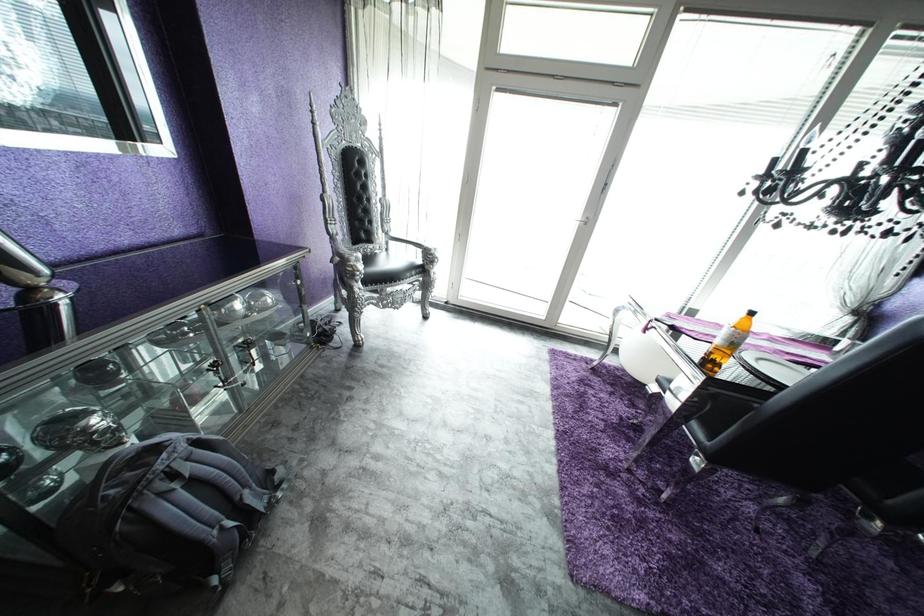
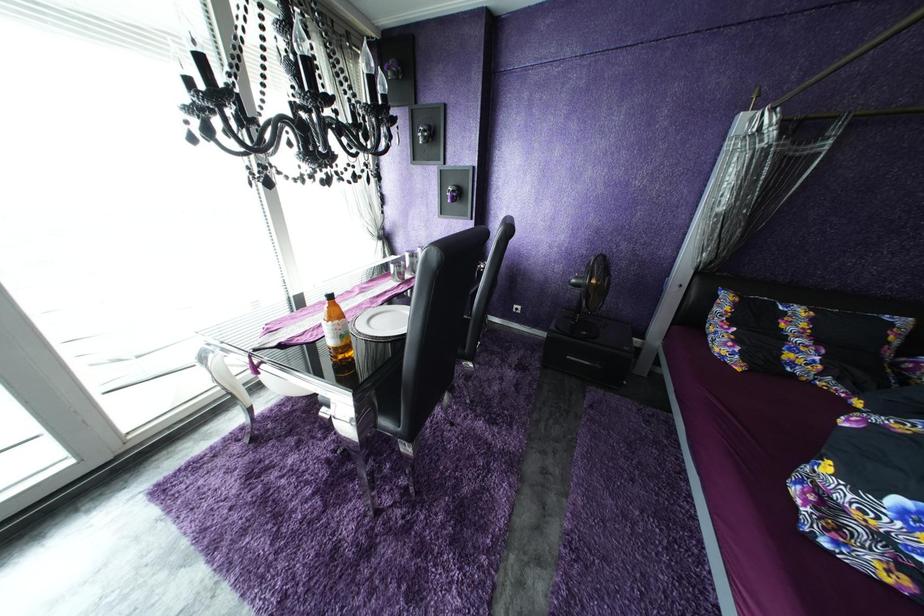
Based on the continuous images, in which direction is the camera rotating?

The rotation direction of the camera is right-down.